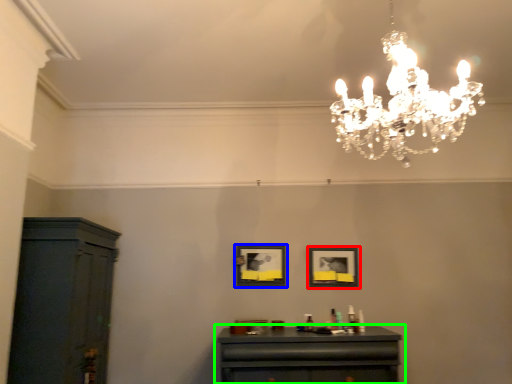
Question: Which object is the farthest from picture frame (highlighted by a red box)? Choose among these: picture frame (highlighted by a blue box) or table (highlighted by a green box).

Choices:
 (A) picture frame
 (B) table

Answer: (B)